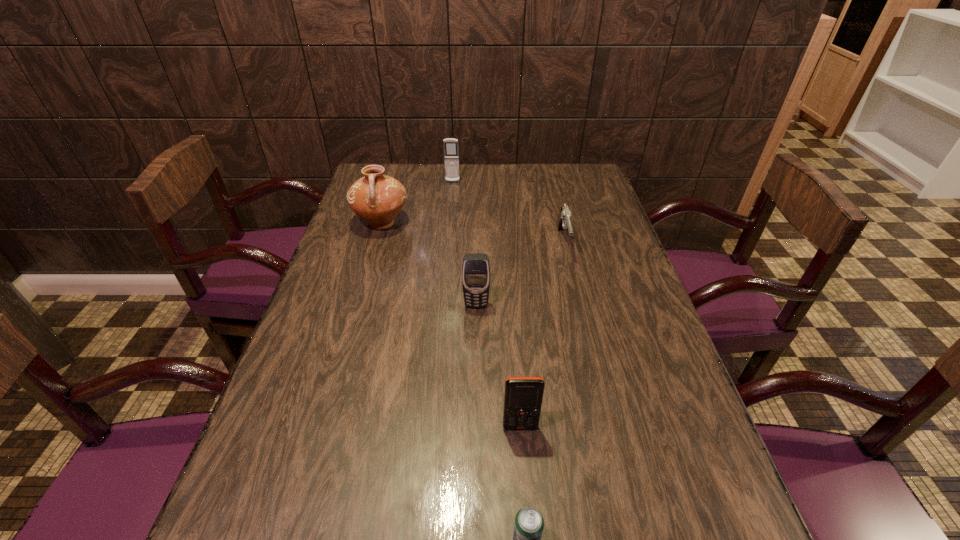
Locate an element on the screen. free point between the second nearest cellular telephone and the gun is located at coordinates (519, 274).

Identify the location of free space between the nearest cellular telephone and the pottery. (451, 325).

This screenshot has height=540, width=960. What are the coordinates of `free spot between the gun and the leftmost object` in the screenshot? It's located at (472, 233).

Choose which object is the second nearest neighbor to the fifth farthest object. Please provide its 2D coordinates. Your answer should be formatted as a tuple, i.e. [(x, y)], where the tuple contains the x and y coordinates of a point satisfying the conditions above.

[(476, 268)]

Identify which object is located as the third nearest to the leftmost object. Please provide its 2D coordinates. Your answer should be formatted as a tuple, i.e. [(x, y)], where the tuple contains the x and y coordinates of a point satisfying the conditions above.

[(563, 222)]

Locate an element on the screen. cellular telephone that stands as the closest to the leftmost object is located at coordinates (451, 154).

You are a GUI agent. You are given a task and a screenshot of the screen. Output one action in this format:
    pyautogui.click(x=<x>, y=<y>)
    Task: Click on the cellular telephone that stands as the second closest to the gun
    The height and width of the screenshot is (540, 960).
    Given the screenshot: What is the action you would take?
    pyautogui.click(x=451, y=154)